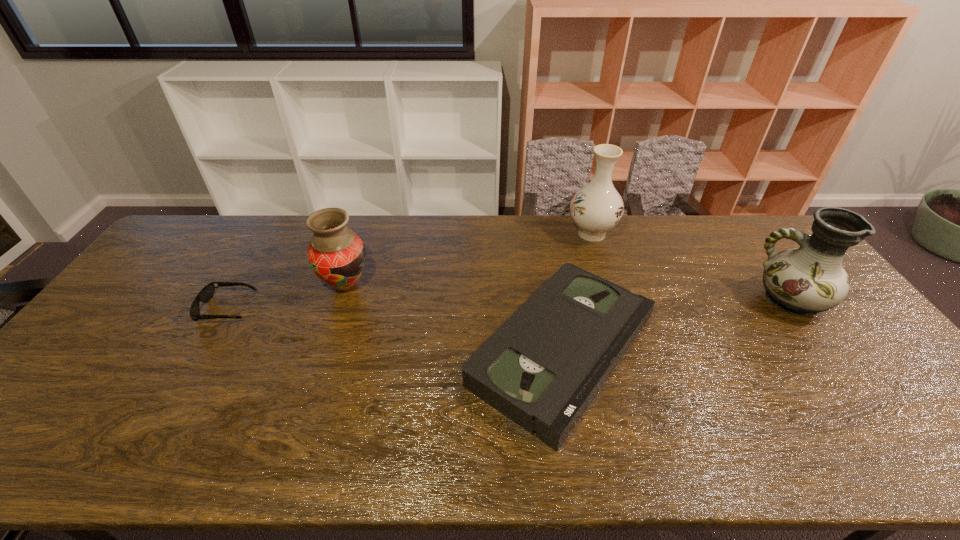
Locate which vase is the closest to the rightmost vase. Please provide its 2D coordinates. Your answer should be formatted as a tuple, i.e. [(x, y)], where the tuple contains the x and y coordinates of a point satisfying the conditions above.

[(596, 208)]

Select which vase appears as the closest to the second shortest object. Please provide its 2D coordinates. Your answer should be formatted as a tuple, i.e. [(x, y)], where the tuple contains the x and y coordinates of a point satisfying the conditions above.

[(596, 208)]

You are a GUI agent. You are given a task and a screenshot of the screen. Output one action in this format:
    pyautogui.click(x=<x>, y=<y>)
    Task: Click on the vacant space that satisfies the following two spatial constraints: 1. on the back side of the videotape; 2. on the left side of the rightmost vase
    
    Given the screenshot: What is the action you would take?
    pyautogui.click(x=554, y=300)

Find the location of a particular element. This screenshot has width=960, height=540. free spot that satisfies the following two spatial constraints: 1. on the front side of the farthest vase; 2. on the front-facing side of the sunglasses is located at coordinates (615, 309).